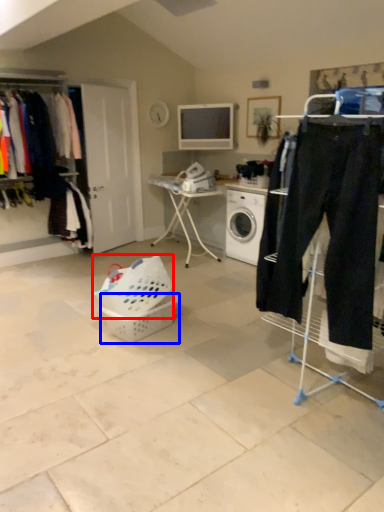
Question: Which point is further to the camera, basket (highlighted by a red box) or basket (highlighted by a blue box)?

Choices:
 (A) basket
 (B) basket

Answer: (B)